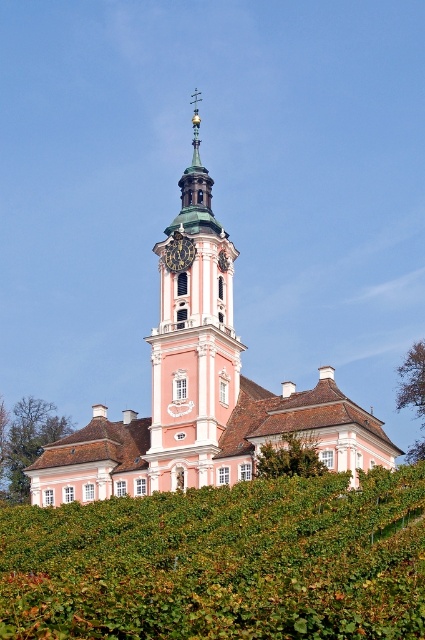
Question: Considering the real-world distances, which object is farthest from the green leafy hedge at lower center?

Choices:
 (A) pink stucco tower at center
 (B) gold metallic clock at center
 (C) pink stucco church at center

Answer: (B)

Question: Which point is closer to the camera?

Choices:
 (A) (195, 282)
 (B) (190, 449)
 (C) (172, 580)
 (D) (170, 266)

Answer: (C)

Question: Does green leafy hedge at lower center have a larger size compared to pink stucco tower at center?

Choices:
 (A) no
 (B) yes

Answer: (A)

Question: Does pink stucco tower at center have a lesser width compared to gold metallic clock at center?

Choices:
 (A) no
 (B) yes

Answer: (A)

Question: Does green leafy hedge at lower center have a lesser width compared to pink stucco church at center?

Choices:
 (A) yes
 (B) no

Answer: (A)

Question: Which of the following is the farthest from the observer?

Choices:
 (A) pink stucco church at center
 (B) green leafy hedge at lower center
 (C) pink stucco tower at center
 (D) gold metallic clock at center

Answer: (D)